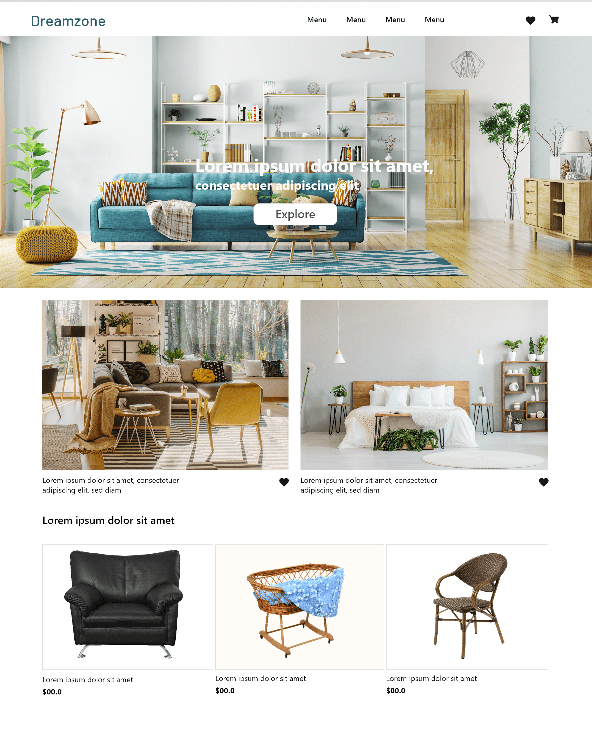
Find the location of a particular element. The image size is (592, 750). leather seat is located at coordinates (135, 615).